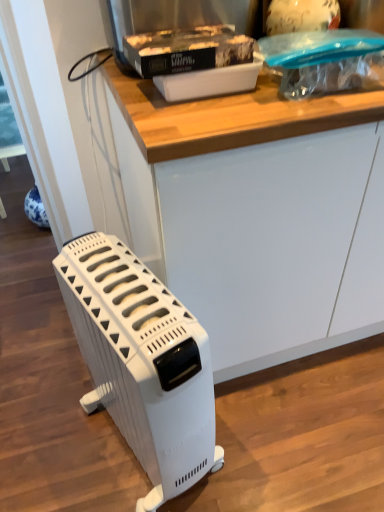
Question: Is white plastic container at upper center in contact with white matte counter at center?

Choices:
 (A) no
 (B) yes

Answer: (A)

Question: Does white plastic container at upper center have a greater width compared to white matte counter at center?

Choices:
 (A) yes
 (B) no

Answer: (B)

Question: Does white plastic container at upper center lie in front of white matte counter at center?

Choices:
 (A) no
 (B) yes

Answer: (A)

Question: Is white plastic container at upper center shorter than white matte counter at center?

Choices:
 (A) yes
 (B) no

Answer: (A)

Question: From a real-world perspective, is white plastic container at upper center positioned over white matte counter at center based on gravity?

Choices:
 (A) no
 (B) yes

Answer: (B)

Question: Which is correct: white plastic container at upper center is inside white matte counter at center, or outside of it?

Choices:
 (A) outside
 (B) inside

Answer: (A)

Question: From the image's perspective, is white plastic container at upper center positioned above or below white matte counter at center?

Choices:
 (A) above
 (B) below

Answer: (A)

Question: Relative to white matte counter at center, is white plastic container at upper center in front or behind?

Choices:
 (A) behind
 (B) front

Answer: (A)

Question: Is white plastic container at upper center taller or shorter than white matte counter at center?

Choices:
 (A) short
 (B) tall

Answer: (A)

Question: Relative to white plastic heater at lower left, is white matte counter at center in front or behind?

Choices:
 (A) front
 (B) behind

Answer: (B)

Question: In terms of size, does white matte counter at center appear bigger or smaller than white plastic heater at lower left?

Choices:
 (A) small
 (B) big

Answer: (B)

Question: Considering the positions of white matte counter at center and white plastic heater at lower left in the image, is white matte counter at center taller or shorter than white plastic heater at lower left?

Choices:
 (A) tall
 (B) short

Answer: (A)

Question: From the image's perspective, is white matte counter at center located above or below white plastic heater at lower left?

Choices:
 (A) above
 (B) below

Answer: (A)

Question: From a real-world perspective, is white plastic container at upper center physically located above or below white plastic heater at lower left?

Choices:
 (A) below
 (B) above

Answer: (B)

Question: Does point (206, 31) appear closer or farther from the camera than point (195, 325)?

Choices:
 (A) farther
 (B) closer

Answer: (A)